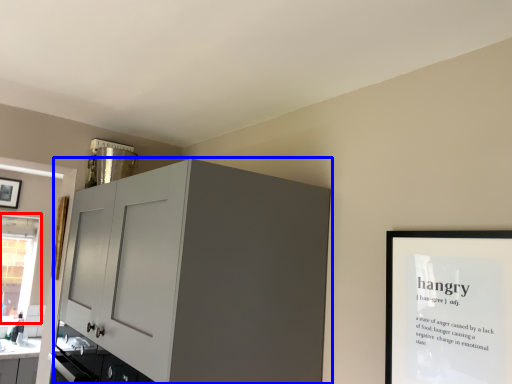
Question: Among these objects, which one is farthest to the camera, window (highlighted by a red box) or cabinetry (highlighted by a blue box)?

Choices:
 (A) window
 (B) cabinetry

Answer: (A)